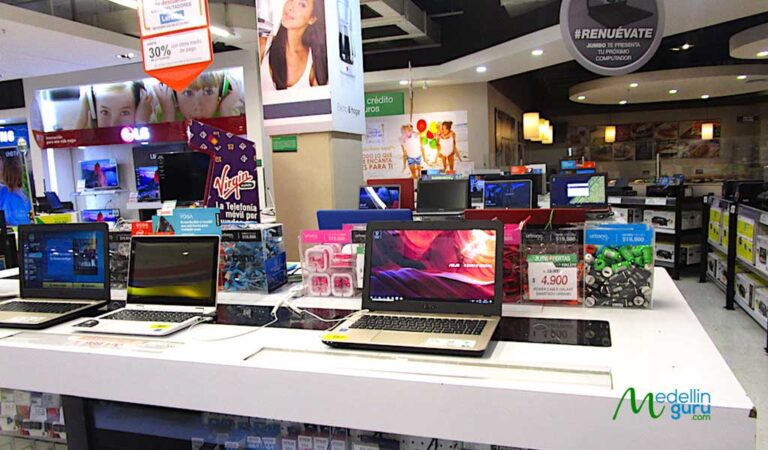
Find the location of a particular element. counter is located at coordinates (223, 352).